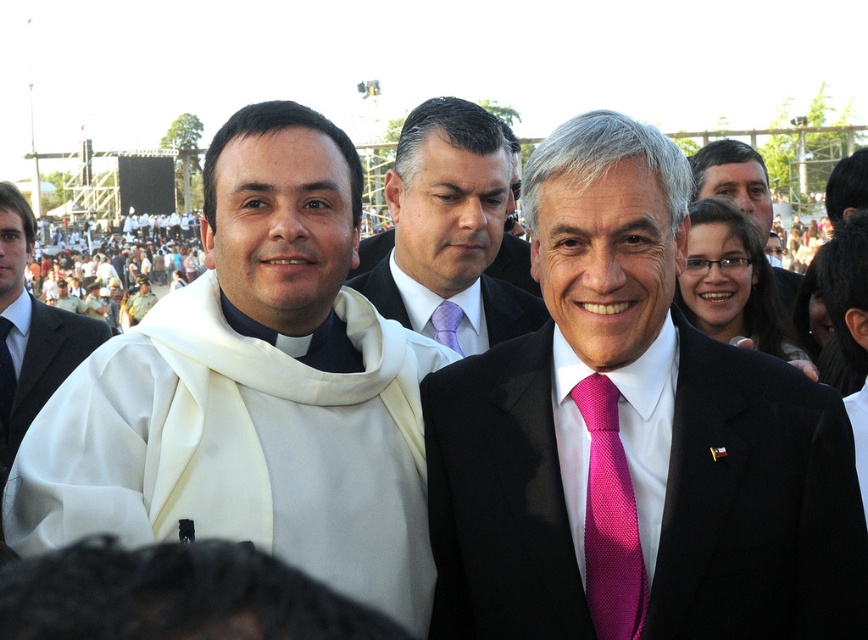
You are organizing a photo shoot and need to place two props next to the pink silk suit at center and the white cloth at left. The props require 1.2 meters of space each. Based on the image, will both props fit next to their respective objects without overlapping?

The pink silk suit at center is narrower than the white cloth at left. Since the props each need 1.2 meters, the white cloth at left likely has enough space, but the pink silk suit at center might be too narrow. Check the exact width before placing props.

You are a photographer at the event and need to capture a closeup shot of both the pink textured tie at center and the white matte tie at center. Given that your camera has a maximum focus range of 50 meters, will you be able to capture both ties in a single shot?

The pink textured tie at center and the white matte tie at center are 53.12 meters apart, which exceeds the camera maximum focus range of 50 meters. Therefore, you cannot capture both ties in a single shot.

You are a photographer standing at the camera position. You want to take a closeup shot of the purple satin tie at center. Can you reach it with your standard zoom lens that has a maximum zoom range of 100 meters? Explain your reasoning.

The purple satin tie at center is 84.52 meters away from the camera. Since the standard zoom lens can zoom up to 100 meters, it is within the lens capability. Therefore, you can take a closeup shot of the purple satin tie at center.